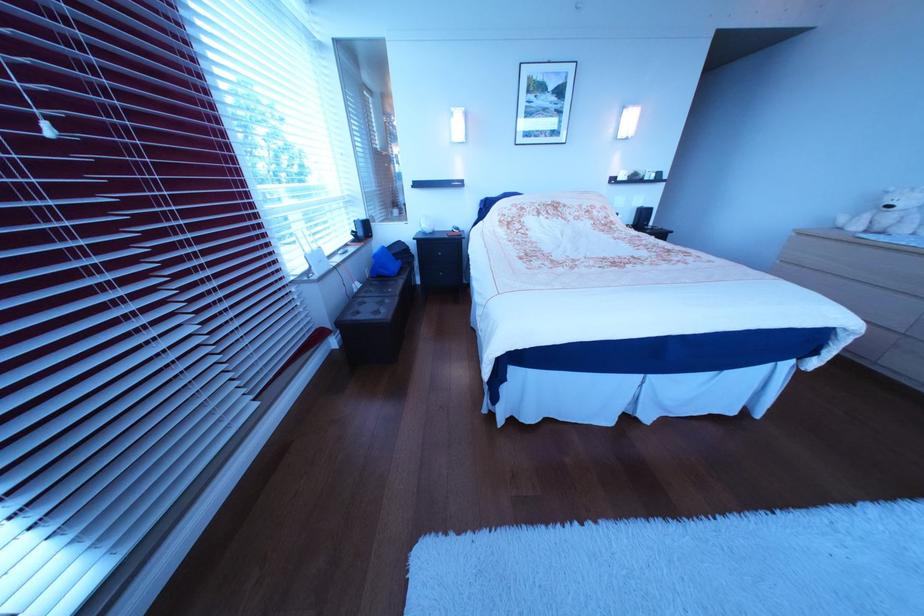
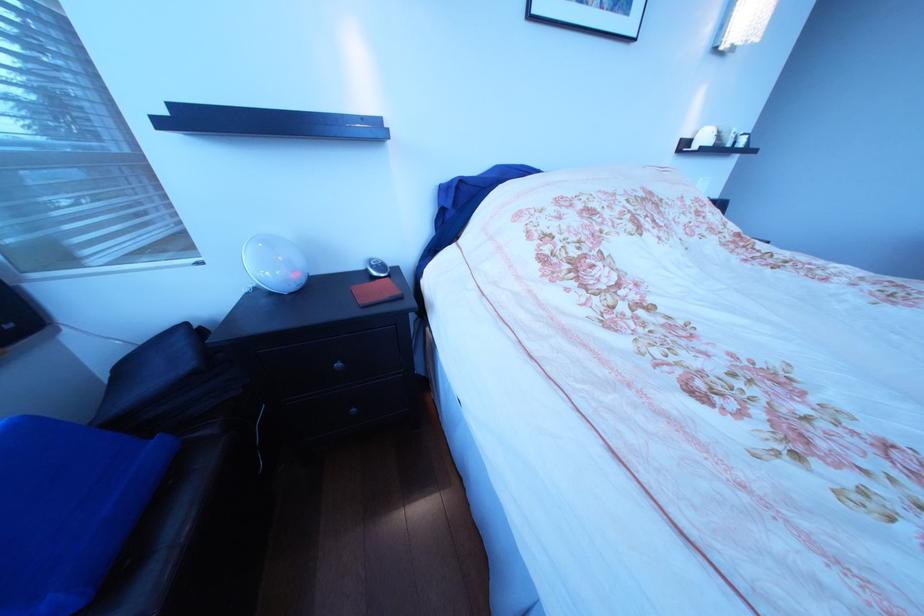
Question: Which direction would the cameraman need to move to produce the second image? Reply with the corresponding letter.

Choices:
 (A) Left
 (B) Right
 (C) Forward
 (D) Backward

Answer: (C)